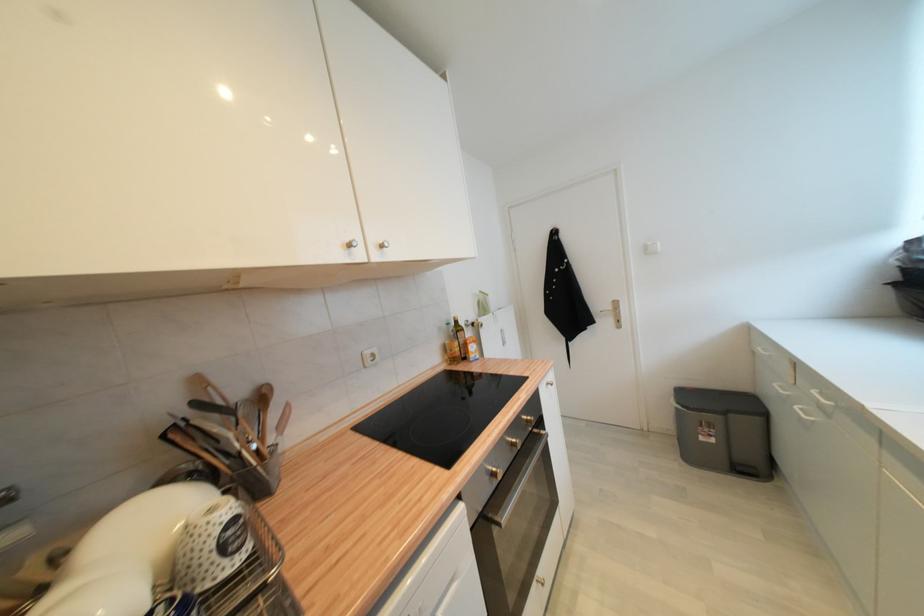
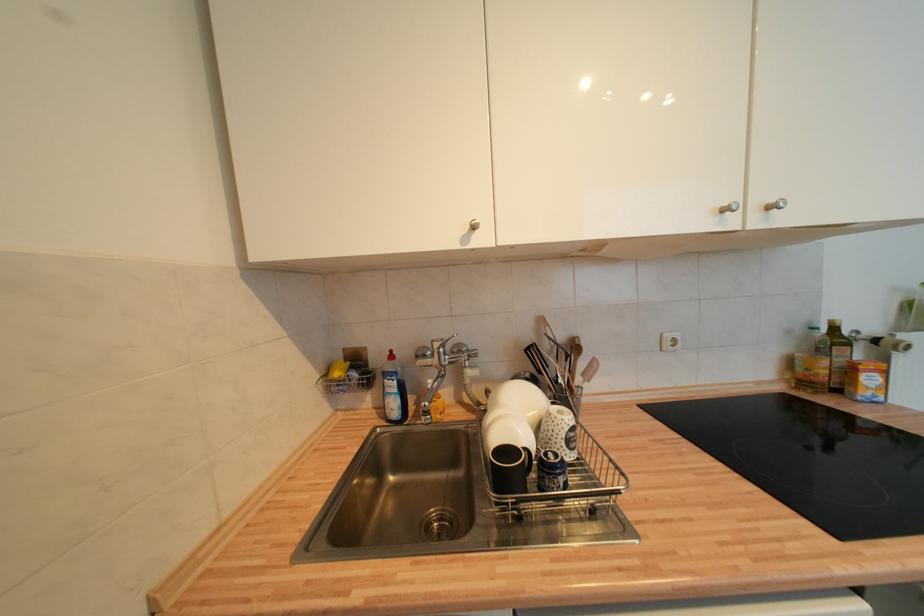
Find the pixel in the second image that matches [355,246] in the first image.

(730, 212)